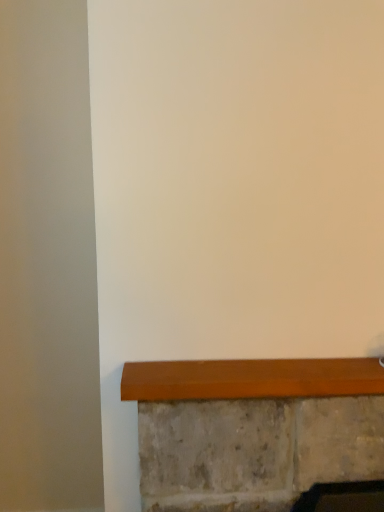
Identify the location of blank space situated above matte wood window sill at lower center (from a real-world perspective). (281, 373).